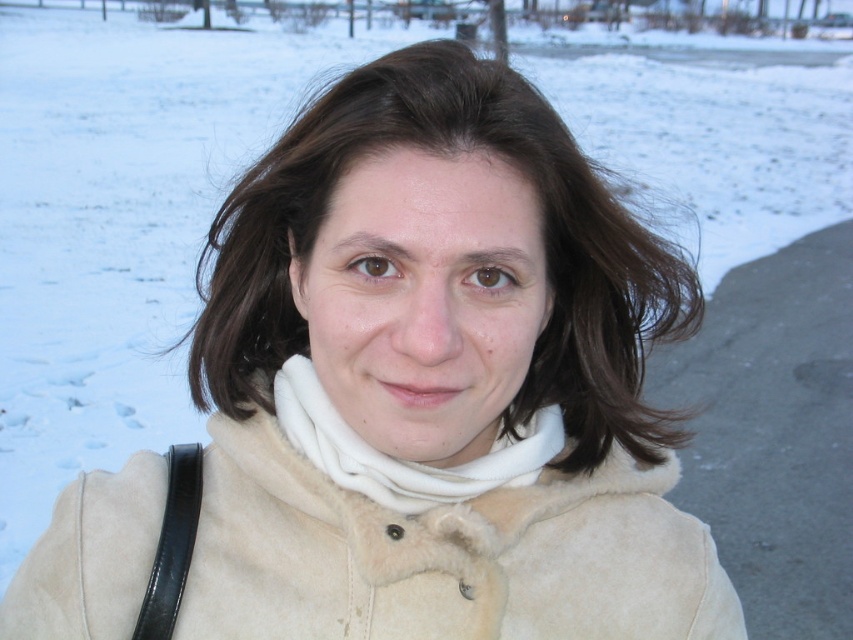
Question: Which object appears closest to the camera in this image?

Choices:
 (A) white fleece scarf at center
 (B) brownwoollyhair at center

Answer: (B)

Question: Which object is the closest to the brownwoollyhair at center?

Choices:
 (A) beige suede coat at center
 (B) white fleece scarf at center

Answer: (B)

Question: Does beige suede coat at center have a smaller size compared to white fleece scarf at center?

Choices:
 (A) no
 (B) yes

Answer: (A)

Question: Is the position of brownwoollyhair at center more distant than that of white fleece scarf at center?

Choices:
 (A) no
 (B) yes

Answer: (A)

Question: Which of the following is the farthest from the observer?

Choices:
 (A) (665, 586)
 (B) (329, 444)

Answer: (A)

Question: Is beige suede coat at center below brownwoollyhair at center?

Choices:
 (A) no
 (B) yes

Answer: (B)